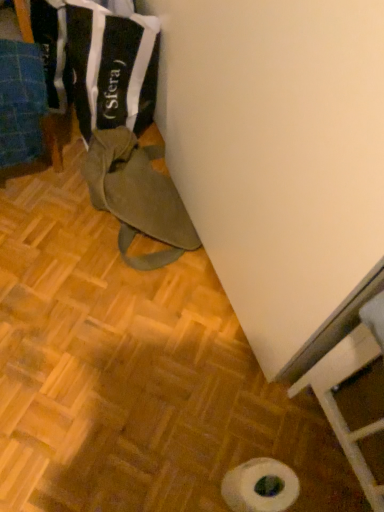
Question: In terms of size, does black fabric bag at upper left appear bigger or smaller than brown matte bag at lower left, the 1th wood viewed from the right?

Choices:
 (A) big
 (B) small

Answer: (B)

Question: In terms of width, does black fabric bag at upper left look wider or thinner when compared to brown matte bag at lower left, arranged as the 2th wood when viewed from the left?

Choices:
 (A) wide
 (B) thin

Answer: (B)

Question: Which object is the closest to the olive green canvas bag at lower left?

Choices:
 (A) brown matte bag at lower left, the 1th wood viewed from the right
 (B) black fabric bag at upper left
 (C) white matte toilet paper at lower center
 (D) blue fabric at left, positioned as the first wood in left-to-right order

Answer: (A)

Question: Estimate the real-world distances between objects in this image. Which object is farther from the white matte toilet paper at lower center?

Choices:
 (A) blue fabric at left, positioned as the first wood in left-to-right order
 (B) brown matte bag at lower left, the 1th wood viewed from the right
 (C) olive green canvas bag at lower left
 (D) black fabric bag at upper left

Answer: (D)